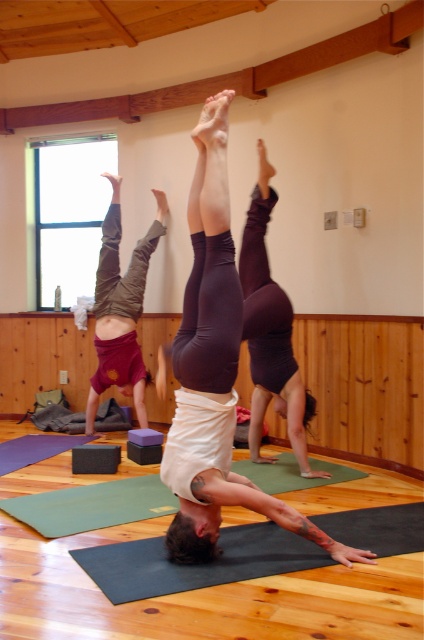
Is wooden beam at upper center to the right of dark purple leggings at center from the viewer's perspective?

In fact, wooden beam at upper center is to the left of dark purple leggings at center.

This screenshot has height=640, width=424. I want to click on wooden beam at upper center, so click(x=233, y=76).

What do you see at coordinates (233, 76) in the screenshot? I see `wooden beam at upper center` at bounding box center [233, 76].

Image resolution: width=424 pixels, height=640 pixels. In order to click on wooden beam at upper center in this screenshot , I will do `click(233, 76)`.

Does dark gray rubber yoga mat at center have a larger size compared to maroon fabric shorts at left?

Incorrect, dark gray rubber yoga mat at center is not larger than maroon fabric shorts at left.

Which is behind, point (251, 564) or point (103, 355)?

The point (103, 355) is more distant.

Locate an element on the screen. dark gray rubber yoga mat at center is located at coordinates (197, 564).

Does dark gray rubber yoga mat at center have a greater width compared to dark purple leggings at center?

Correct, the width of dark gray rubber yoga mat at center exceeds that of dark purple leggings at center.

Who is taller, dark gray rubber yoga mat at center or dark purple leggings at center?

dark purple leggings at center is taller.

Who is more distant from viewer, [401,513] or [292,416]?

The point [292,416] is behind.

Identify the location of dark gray rubber yoga mat at center. (x=197, y=564).